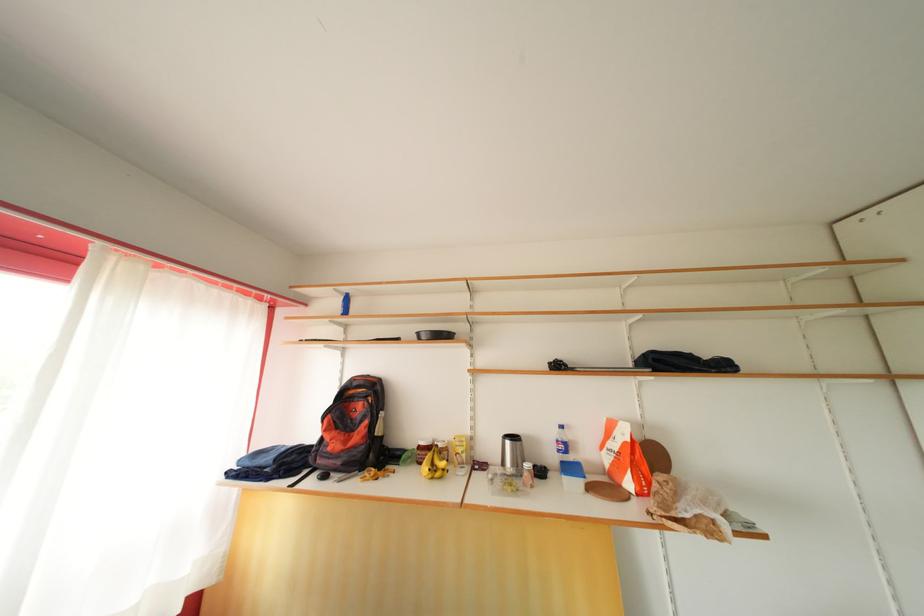
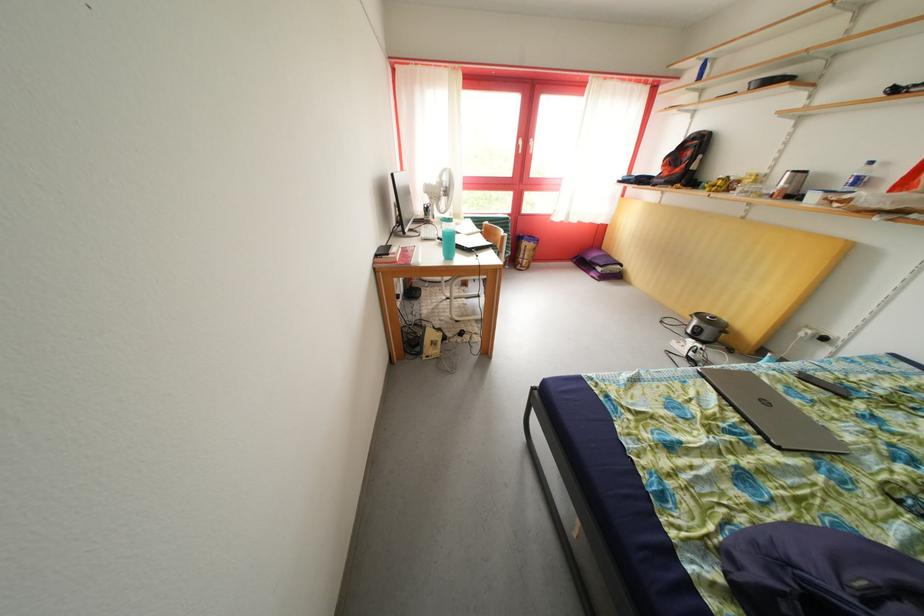
The point at (x=351, y=403) is marked in the first image. Where is the corresponding point in the second image?

(689, 153)